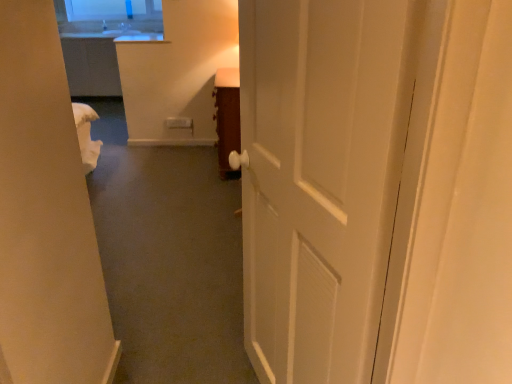
Locate an element on the screen. This screenshot has height=384, width=512. white glossy door at center is located at coordinates (321, 178).

What do you see at coordinates (321, 178) in the screenshot?
I see `white glossy door at center` at bounding box center [321, 178].

Image resolution: width=512 pixels, height=384 pixels. I want to click on wooden cabinet at center, so click(227, 117).

What do you see at coordinates (227, 117) in the screenshot?
I see `wooden cabinet at center` at bounding box center [227, 117].

Find the location of a particular element. This screenshot has height=384, width=512. white glossy door at center is located at coordinates (321, 178).

Is white glossy door at center at the right side of wooden cabinet at center?

Yes.

Considering the positions of objects white glossy door at center and wooden cabinet at center in the image provided, who is behind, white glossy door at center or wooden cabinet at center?

wooden cabinet at center is further away from the camera.

Considering the positions of point (384, 236) and point (237, 84), is point (384, 236) closer or farther from the camera than point (237, 84)?

Point (384, 236) is closer to the camera than point (237, 84).

From the image's perspective, is white glossy door at center located above or below wooden cabinet at center?

white glossy door at center is below wooden cabinet at center.

From a real-world perspective, who is located lower, white glossy door at center or wooden cabinet at center?

In real-world perspective, wooden cabinet at center is lower.

Considering the sizes of white glossy door at center and wooden cabinet at center in the image, is white glossy door at center wider or thinner than wooden cabinet at center?

Clearly, white glossy door at center has less width compared to wooden cabinet at center.

Considering the sizes of objects white glossy door at center and wooden cabinet at center in the image provided, who is taller, white glossy door at center or wooden cabinet at center?

With more height is white glossy door at center.

In terms of size, does white glossy door at center appear bigger or smaller than wooden cabinet at center?

In the image, white glossy door at center appears to be larger than wooden cabinet at center.

Could wooden cabinet at center be considered to be inside white glossy door at center?

Definitely not — wooden cabinet at center is not inside white glossy door at center.

Is white glossy door at center positioned far away from wooden cabinet at center?

white glossy door at center is positioned a significant distance from wooden cabinet at center.

Is white glossy door at center oriented away from wooden cabinet at center?

white glossy door at center is not turned away from wooden cabinet at center.

Can you tell me how much white glossy door at center and wooden cabinet at center differ in facing direction?

14.9 degrees.

Image resolution: width=512 pixels, height=384 pixels. I want to click on furniture on the left of the white glossy door at center, so click(227, 117).

Which object is positioned more to the right, wooden cabinet at center or white glossy door at center?

Positioned to the right is white glossy door at center.

Is the depth of wooden cabinet at center less than that of white glossy door at center?

No.

Considering the positions of points (222, 103) and (268, 24), is point (222, 103) closer to camera compared to point (268, 24)?

No, (222, 103) is further to viewer.

From the image's perspective, is wooden cabinet at center located above or below white glossy door at center?

wooden cabinet at center is above white glossy door at center.

From a real-world perspective, is wooden cabinet at center positioned above or below white glossy door at center?

Clearly, from a real-world perspective, wooden cabinet at center is below white glossy door at center.

Looking at their sizes, would you say wooden cabinet at center is wider or thinner than white glossy door at center?

Considering their sizes, wooden cabinet at center looks broader than white glossy door at center.

Which of these two, wooden cabinet at center or white glossy door at center, stands taller?

white glossy door at center is taller.

Based on their sizes in the image, would you say wooden cabinet at center is bigger or smaller than white glossy door at center?

In the image, wooden cabinet at center appears to be smaller than white glossy door at center.

Is wooden cabinet at center inside or outside of white glossy door at center?

The correct answer is: outside.

Is wooden cabinet at center with white glossy door at center?

No.

Is wooden cabinet at center turned away from white glossy door at center?

That's not correct — wooden cabinet at center is not looking away from white glossy door at center.

How different are the orientations of wooden cabinet at center and white glossy door at center in degrees?

The angle between the facing direction of wooden cabinet at center and the facing direction of white glossy door at center is 14.9 degrees.

The height and width of the screenshot is (384, 512). What are the coordinates of `door above the wooden cabinet at center (from a real-world perspective)` in the screenshot? It's located at (321, 178).

Identify the location of door that appears above the wooden cabinet at center (from a real-world perspective). (321, 178).

In order to click on furniture on the left of the white glossy door at center in this screenshot , I will do `click(227, 117)`.